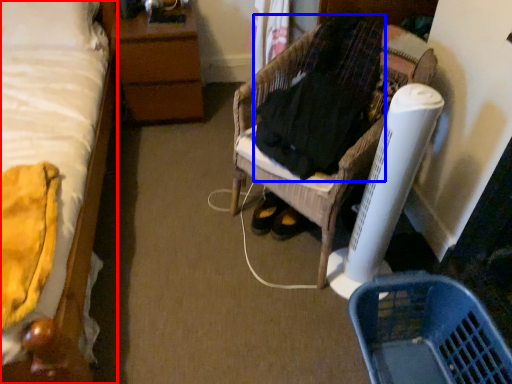
Question: Which object is closer to the camera taking this photo, bed (highlighted by a red box) or clothing (highlighted by a blue box)?

Choices:
 (A) bed
 (B) clothing

Answer: (A)